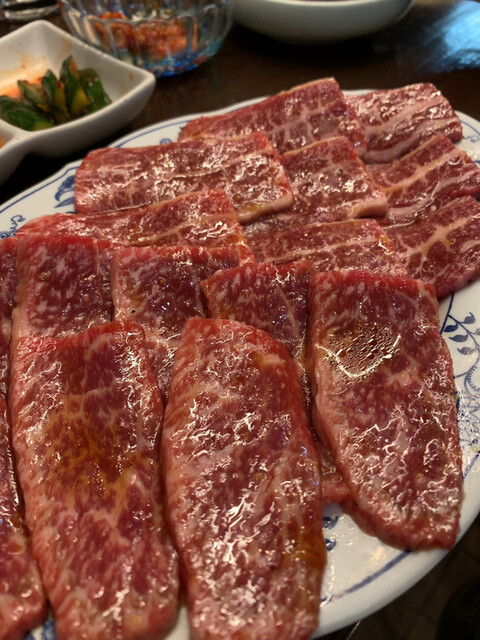
The width and height of the screenshot is (480, 640). What are the coordinates of `glass` in the screenshot? It's located at (25, 6).